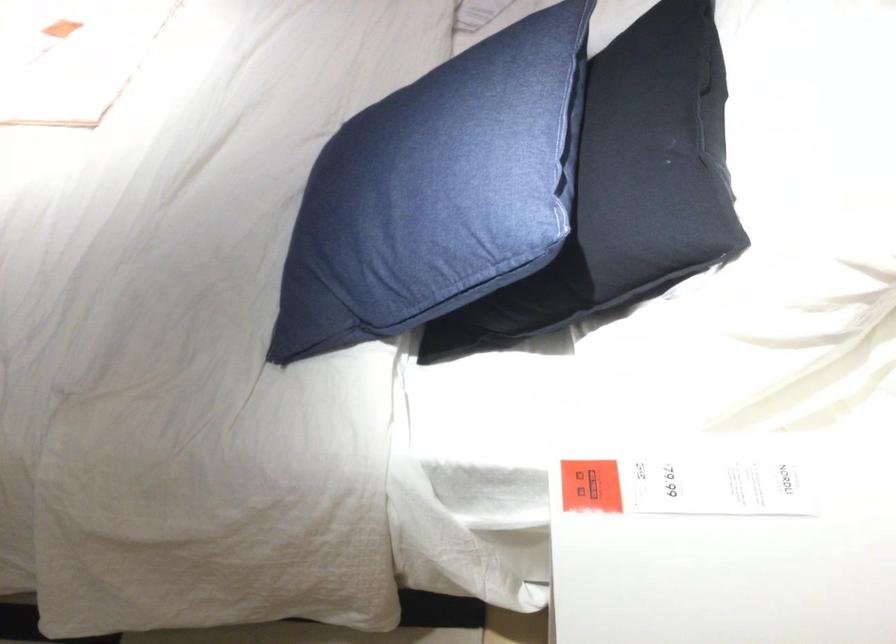
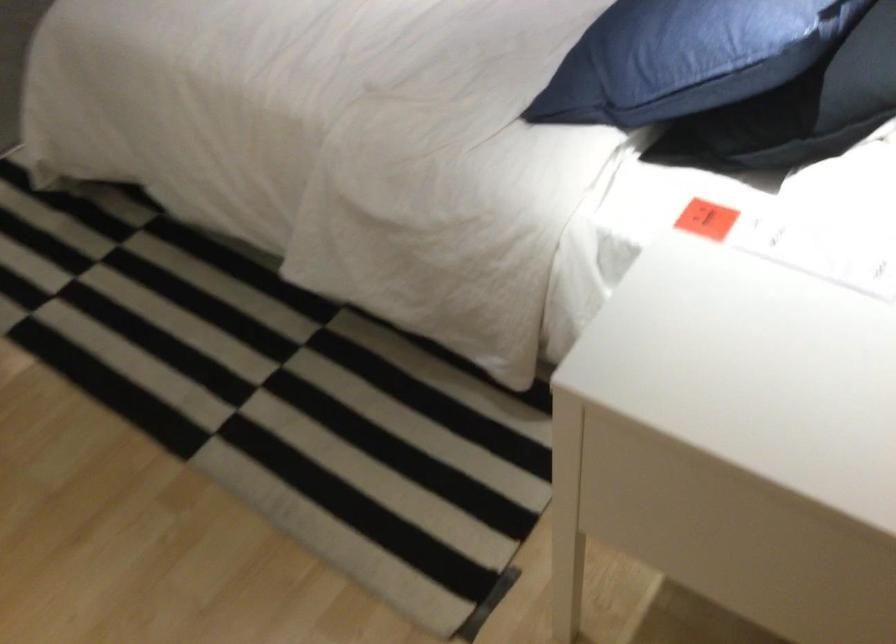
The point at (587, 483) is marked in the first image. Where is the corresponding point in the second image?

(707, 219)